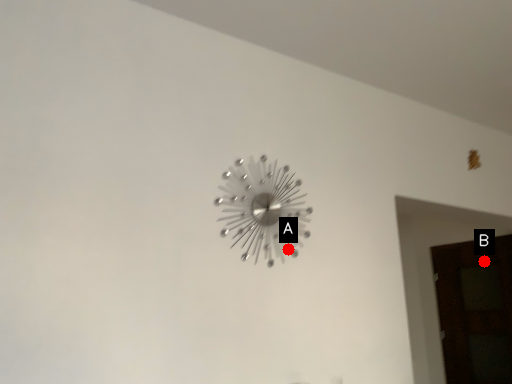
Question: Two points are circled on the image, labeled by A and B beside each circle. Which of the following is the closest to the observer?

Choices:
 (A) A is closer
 (B) B is closer

Answer: (A)